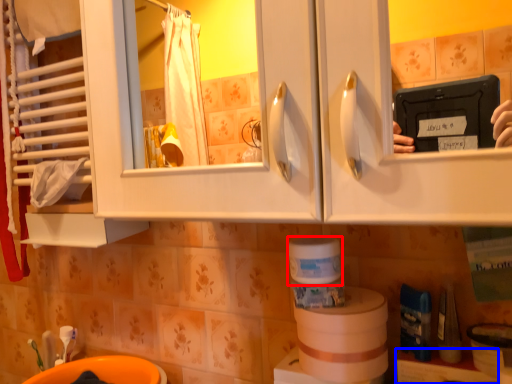
Question: Which object is closer to the camera taking this photo, toilet paper (highlighted by a red box) or shelf (highlighted by a blue box)?

Choices:
 (A) toilet paper
 (B) shelf

Answer: (B)